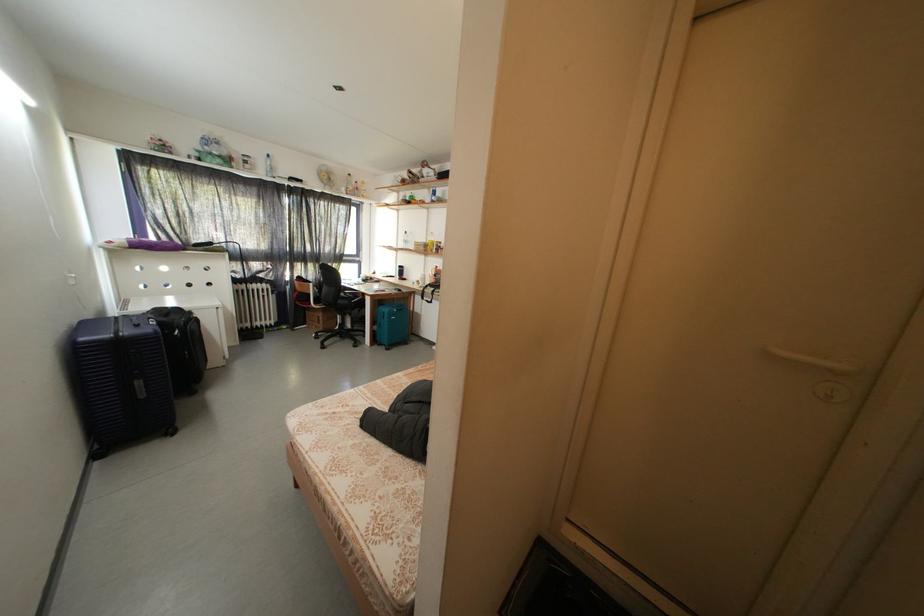
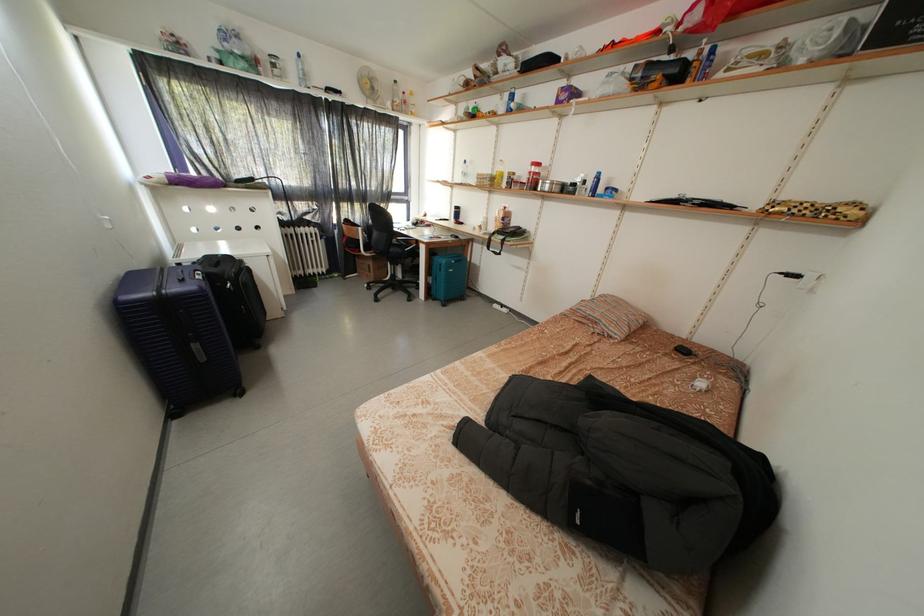
Where in the second image is the point corresponding to [355,307] from the first image?

(407, 256)